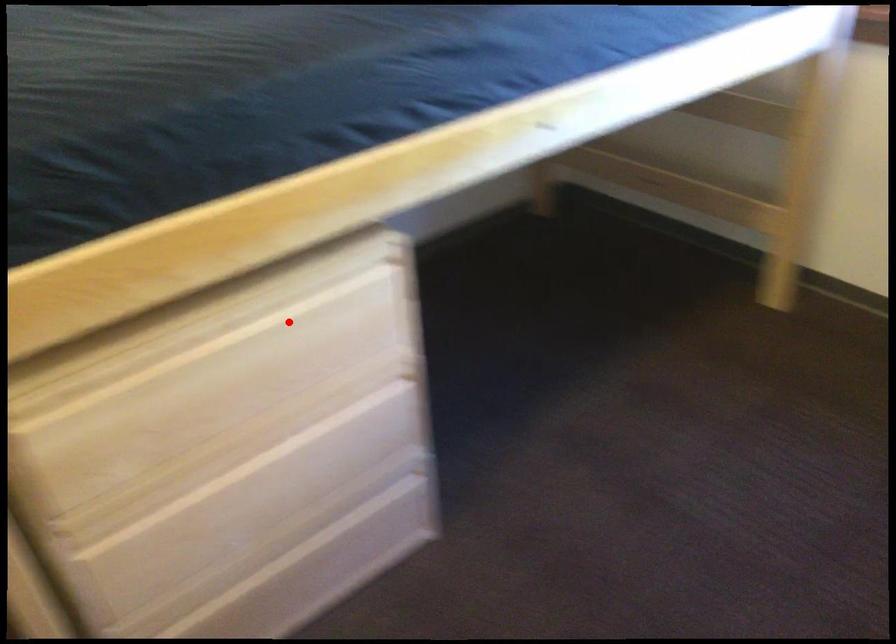
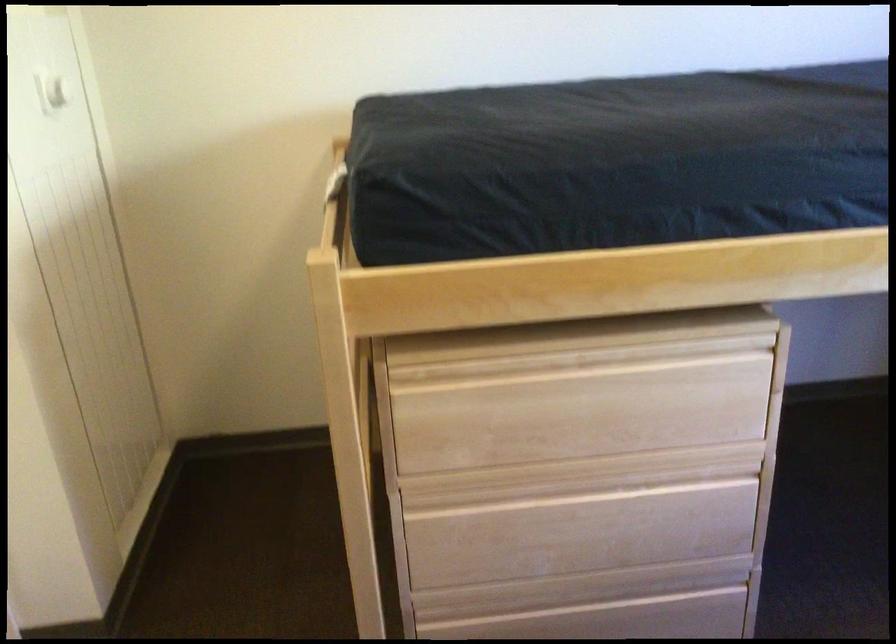
The point at the highlighted location is marked in the first image. Where is the corresponding point in the second image?

(642, 377)